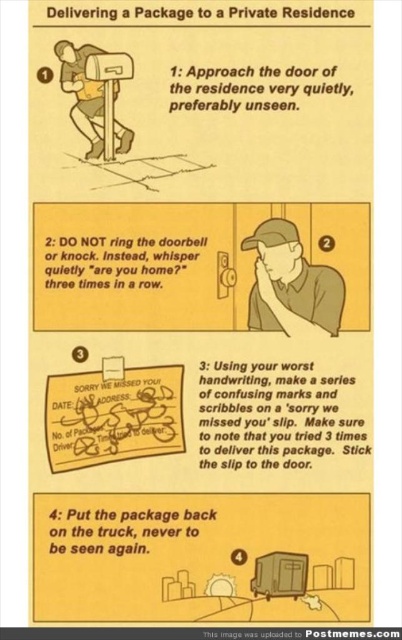
You are a delivery person trying to follow the instructions in the image. You need to place a package in the mailbox. Which object should you look for first, the brown cap at center or the metallic mailbox at upper left?

The metallic mailbox at upper left is the correct object for placing the package. The brown cap at center is smaller than the metallic mailbox at upper left, so the mailbox is larger and more suitable for holding a package.